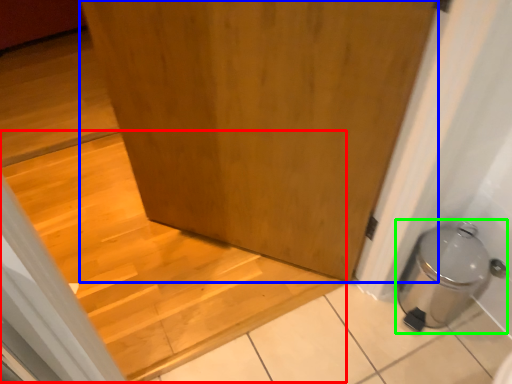
Question: Which object is the farthest from stairwell (highlighted by a red box)? Choose among these: door (highlighted by a blue box) or water heater (highlighted by a green box).

Choices:
 (A) door
 (B) water heater

Answer: (B)